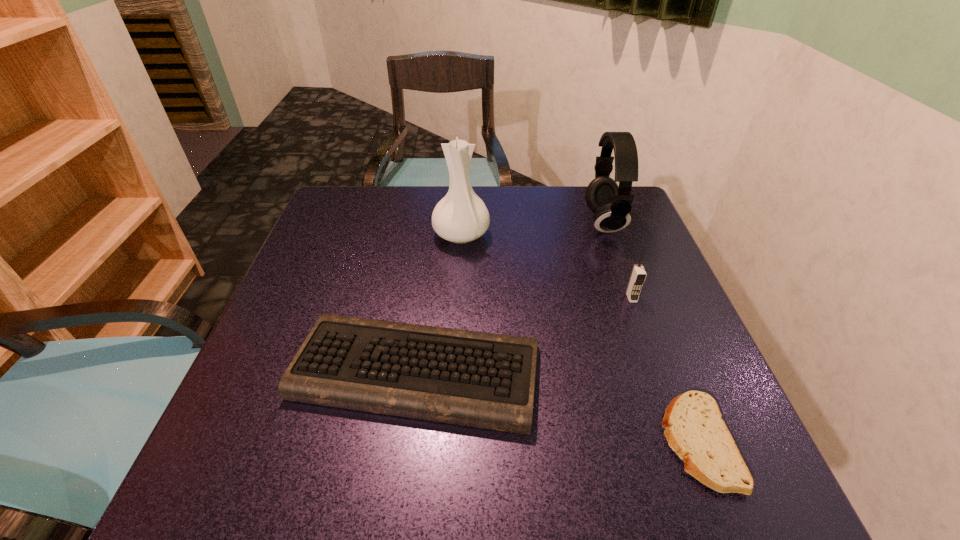
Where is `free spot between the pita bread and the earphone`? The height and width of the screenshot is (540, 960). free spot between the pita bread and the earphone is located at coordinates (651, 333).

Find the location of a particular element. This screenshot has height=540, width=960. vacant point located between the pita bread and the fourth tallest object is located at coordinates (557, 407).

Identify the location of vacant space that is in between the vase and the fourth tallest object. The height and width of the screenshot is (540, 960). (439, 303).

Locate an element on the screen. free space between the vase and the second shortest object is located at coordinates (439, 303).

Identify the location of empty space that is in between the vase and the pita bread. (579, 339).

Where is `empty location between the fourth tallest object and the vase`? The image size is (960, 540). empty location between the fourth tallest object and the vase is located at coordinates (439, 303).

What are the coordinates of `free space that is in between the earphone and the vase` in the screenshot? It's located at (533, 228).

This screenshot has width=960, height=540. I want to click on vacant area that lies between the earphone and the cellular telephone, so click(x=617, y=260).

Locate an element on the screen. Image resolution: width=960 pixels, height=540 pixels. the third closest object to the pita bread is located at coordinates (611, 204).

You are a GUI agent. You are given a task and a screenshot of the screen. Output one action in this format:
    pyautogui.click(x=<x>, y=<y>)
    Task: Click on the object that is the closest one to the shortest object
    
    Given the screenshot: What is the action you would take?
    pyautogui.click(x=477, y=379)